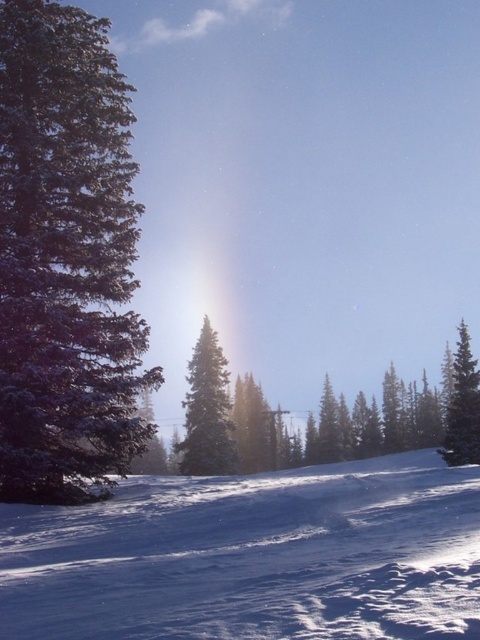
Based on the photo, which is above, green matte evergreen tree at left or green matte tree at right?

green matte evergreen tree at left is above.

Is point (132, 432) closer to camera compared to point (442, 449)?

Yes, it is in front of point (442, 449).

At what (x,y) coordinates should I click in order to perform the action: click on green matte evergreen tree at left. Please return your answer as a coordinate pair (x, y). Image resolution: width=480 pixels, height=640 pixels. Looking at the image, I should click on (67, 259).

Measure the distance between green matte evergreen tree at left and green matte evergreen tree at center.

The distance of green matte evergreen tree at left from green matte evergreen tree at center is 27.84 meters.

Is green matte evergreen tree at left shorter than green matte evergreen tree at center?

Yes, green matte evergreen tree at left is shorter than green matte evergreen tree at center.

Which is behind, point (12, 500) or point (226, 387)?

The point (226, 387) is behind.

This screenshot has width=480, height=640. Find the location of `green matte evergreen tree at left`. green matte evergreen tree at left is located at coordinates (67, 259).

Is white powdery snow at center to the right of green matte evergreen tree at left from the viewer's perspective?

Yes, white powdery snow at center is to the right of green matte evergreen tree at left.

Who is shorter, white powdery snow at center or green matte evergreen tree at left?

Standing shorter between the two is white powdery snow at center.

Find the location of a particular element. This screenshot has width=480, height=640. white powdery snow at center is located at coordinates (252, 556).